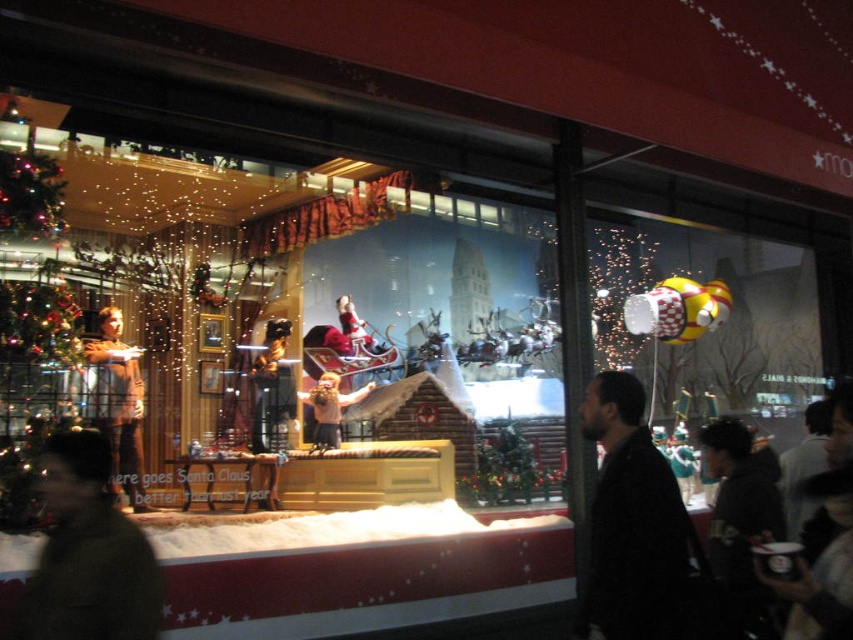
Question: Which of these objects is positioned farthest from the matte brown jacket at left?

Choices:
 (A) brown leather jacket at center
 (B) green wool coat at lower left
 (C) black wool coat at right

Answer: (C)

Question: Based on their relative distances, which object is farther from the black wool coat at right?

Choices:
 (A) brown leather jacket at center
 (B) green wool coat at lower left

Answer: (A)

Question: Among these points, which one is farthest from the camera?

Choices:
 (A) (614, 584)
 (B) (321, 413)
 (C) (125, 388)

Answer: (B)

Question: Does black wool coat at right appear under green wool coat at lower left?

Choices:
 (A) yes
 (B) no

Answer: (B)

Question: From the image, what is the correct spatial relationship of green wool coat at lower left in relation to matte brown jacket at left?

Choices:
 (A) above
 (B) below

Answer: (B)

Question: Is green wool coat at lower left behind matte brown jacket at left?

Choices:
 (A) no
 (B) yes

Answer: (A)